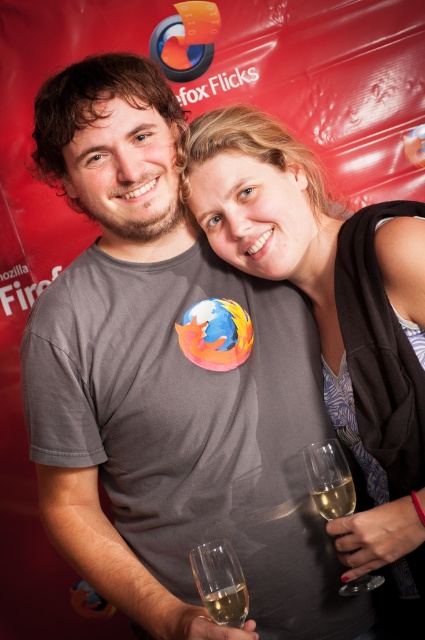
Which is behind, point (390, 304) or point (235, 586)?

Point (390, 304)

Between point (240, 128) and point (241, 595), which one is positioned in front?

Point (241, 595)

Find the location of a particular element. This screenshot has height=640, width=425. matte gray shirt at center is located at coordinates (333, 310).

Is point (374, 580) behind point (234, 611)?

Yes, point (374, 580) is behind point (234, 611).

The height and width of the screenshot is (640, 425). What do you see at coordinates (328, 477) in the screenshot?
I see `clear glass wine glass at lower right` at bounding box center [328, 477].

You are a GUI agent. You are given a task and a screenshot of the screen. Output one action in this format:
    pyautogui.click(x=<x>, y=<y>)
    Task: Click on the clear glass wine glass at lower right
    The height and width of the screenshot is (640, 425).
    Given the screenshot: What is the action you would take?
    pyautogui.click(x=328, y=477)

At what (x,y) coordinates should I click in order to perform the action: click on matte gray shirt at center. Please return your answer as a coordinate pair (x, y). The width and height of the screenshot is (425, 640). Looking at the image, I should click on (333, 310).

Is matte gray shirt at center in front of clear glass wine glass at lower right?

Yes, matte gray shirt at center is closer to the viewer.

The height and width of the screenshot is (640, 425). I want to click on matte gray shirt at center, so click(333, 310).